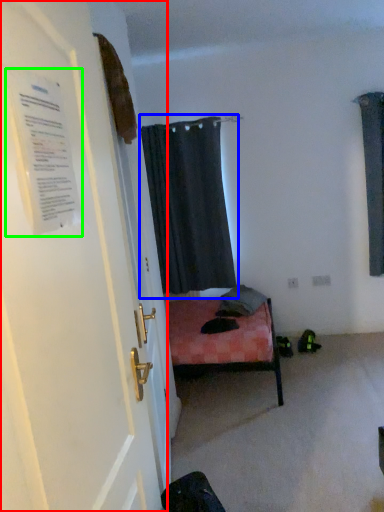
Question: Based on their relative distances, which object is farther from door (highlighted by a red box)? Choose from curtain (highlighted by a blue box) and poster (highlighted by a green box).

Choices:
 (A) curtain
 (B) poster

Answer: (A)